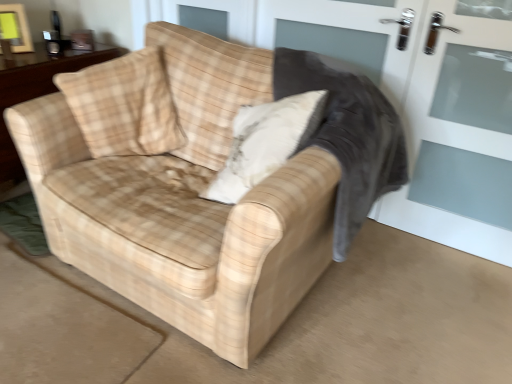
Question: Is there a large distance between beige plaid throw pillow at center, which is counted as the second throw pillow, starting from the left, and plaid fabric rocking chair at center?

Choices:
 (A) no
 (B) yes

Answer: (A)

Question: From a real-world perspective, is beige plaid throw pillow at center, placed as the 1th throw pillow when sorted from right to left, below plaid fabric rocking chair at center?

Choices:
 (A) yes
 (B) no

Answer: (B)

Question: Is beige plaid throw pillow at center, which is counted as the second throw pillow, starting from the left, bigger than plaid fabric rocking chair at center?

Choices:
 (A) no
 (B) yes

Answer: (A)

Question: Is beige plaid throw pillow at center, placed as the 1th throw pillow when sorted from right to left, taller than plaid fabric rocking chair at center?

Choices:
 (A) no
 (B) yes

Answer: (A)

Question: Is beige plaid throw pillow at center, which is counted as the second throw pillow, starting from the left, next to plaid fabric rocking chair at center?

Choices:
 (A) no
 (B) yes

Answer: (A)

Question: Is plaid fabric rocking chair at center a part of beige plaid throw pillow at center, placed as the 1th throw pillow when sorted from right to left?

Choices:
 (A) yes
 (B) no

Answer: (B)

Question: From a real-world perspective, is beige plaid throw pillow at upper left, which ranks as the 1th throw pillow in left-to-right order, under white glass screen door at right?

Choices:
 (A) no
 (B) yes

Answer: (A)

Question: From the image's perspective, is beige plaid throw pillow at upper left, which ranks as the 1th throw pillow in left-to-right order, on white glass screen door at right?

Choices:
 (A) yes
 (B) no

Answer: (A)

Question: Can you confirm if beige plaid throw pillow at upper left, which ranks as the 1th throw pillow in left-to-right order, is thinner than white glass screen door at right?

Choices:
 (A) yes
 (B) no

Answer: (B)

Question: Is beige plaid throw pillow at upper left, acting as the 2th throw pillow starting from the right, facing towards white glass screen door at right?

Choices:
 (A) yes
 (B) no

Answer: (B)

Question: Is the position of beige plaid throw pillow at upper left, acting as the 2th throw pillow starting from the right, less distant than that of white glass screen door at right?

Choices:
 (A) yes
 (B) no

Answer: (B)

Question: Is beige plaid throw pillow at upper left, acting as the 2th throw pillow starting from the right, wider than white glass screen door at right?

Choices:
 (A) no
 (B) yes

Answer: (B)

Question: Considering the relative sizes of beige plaid throw pillow at upper left, acting as the 2th throw pillow starting from the right, and beige plaid throw pillow at center, placed as the 1th throw pillow when sorted from right to left, in the image provided, is beige plaid throw pillow at upper left, acting as the 2th throw pillow starting from the right, thinner than beige plaid throw pillow at center, placed as the 1th throw pillow when sorted from right to left,?

Choices:
 (A) no
 (B) yes

Answer: (B)